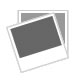
This screenshot has height=80, width=80. What are the coordinates of `white space above pictures` in the screenshot? It's located at (27, 7), (14, 17), (72, 23).